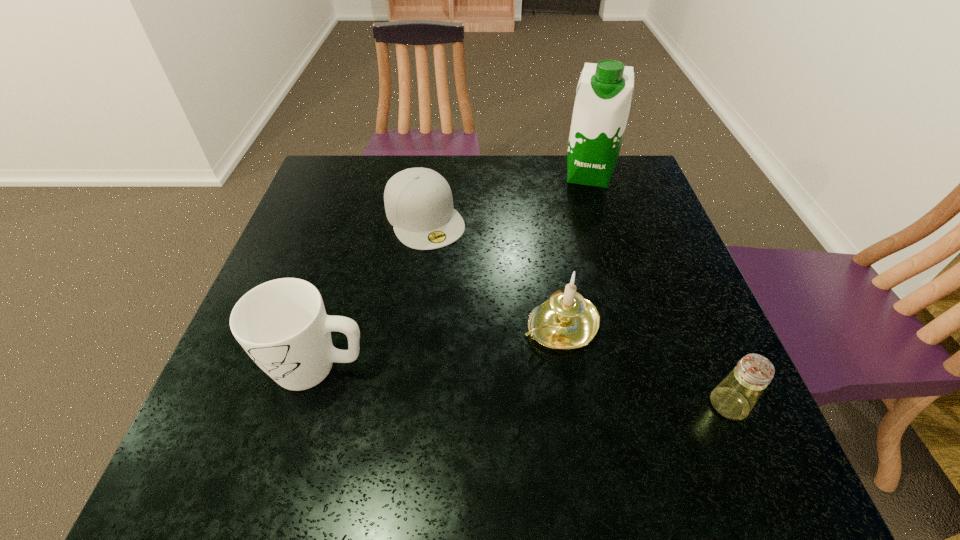
The height and width of the screenshot is (540, 960). I want to click on object that is at the left edge, so click(282, 324).

Identify the location of saltshaker situated at the right edge. (734, 397).

Find the location of a particular element. soya milk positioned at the right edge is located at coordinates tap(602, 104).

Locate an element on the screen. Image resolution: width=960 pixels, height=540 pixels. object located in the near left corner section of the desktop is located at coordinates (282, 324).

In order to click on object located at the far right corner in this screenshot , I will do `click(602, 104)`.

This screenshot has width=960, height=540. I want to click on object at the near right corner, so click(x=734, y=397).

Identify the location of vacant area at the far edge. The image size is (960, 540). (377, 188).

Where is `free space at the near edge of the desktop`? The image size is (960, 540). free space at the near edge of the desktop is located at coordinates (492, 391).

Image resolution: width=960 pixels, height=540 pixels. In order to click on free space at the left edge of the desktop in this screenshot , I will do `click(295, 251)`.

Identify the location of vacant space at the right edge of the desktop. (648, 206).